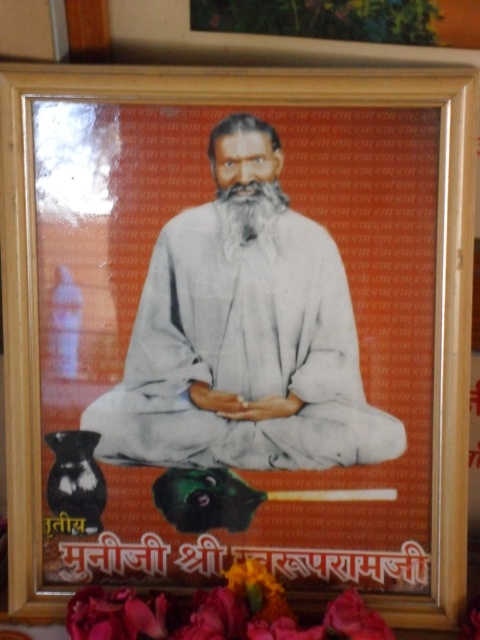
Does white cloth at center have a smaller size compared to white soft beard at center?

No.

Between point (159, 444) and point (274, 248), which one is positioned behind?

The point (159, 444) is behind.

The image size is (480, 640). What do you see at coordinates (242, 336) in the screenshot?
I see `white cloth at center` at bounding box center [242, 336].

The image size is (480, 640). I want to click on white cloth at center, so click(x=242, y=336).

Is white cloth at center below silky pink petals at lower center?

Incorrect, white cloth at center is not positioned below silky pink petals at lower center.

Can you confirm if white cloth at center is wider than silky pink petals at lower center?

Yes.

Who is more distant from viewer, (180, 369) or (360, 596)?

Positioned behind is point (180, 369).

Find the location of a particular element. The image size is (480, 640). white cloth at center is located at coordinates (242, 336).

Does silky pink petals at lower center have a larger size compared to white soft beard at center?

Yes.

Is point (216, 605) more distant than point (240, 184)?

No, (216, 605) is in front of (240, 184).

Locate an element on the screen. silky pink petals at lower center is located at coordinates (218, 612).

In order to click on silky pink petals at lower center in this screenshot , I will do `click(218, 612)`.